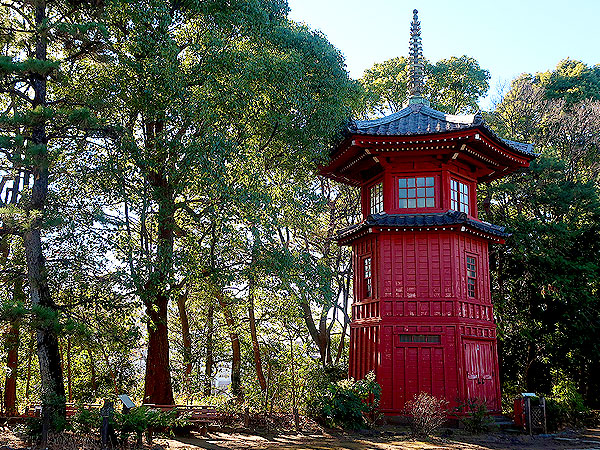
The width and height of the screenshot is (600, 450). Find the location of `benches`. benches is located at coordinates (195, 410).